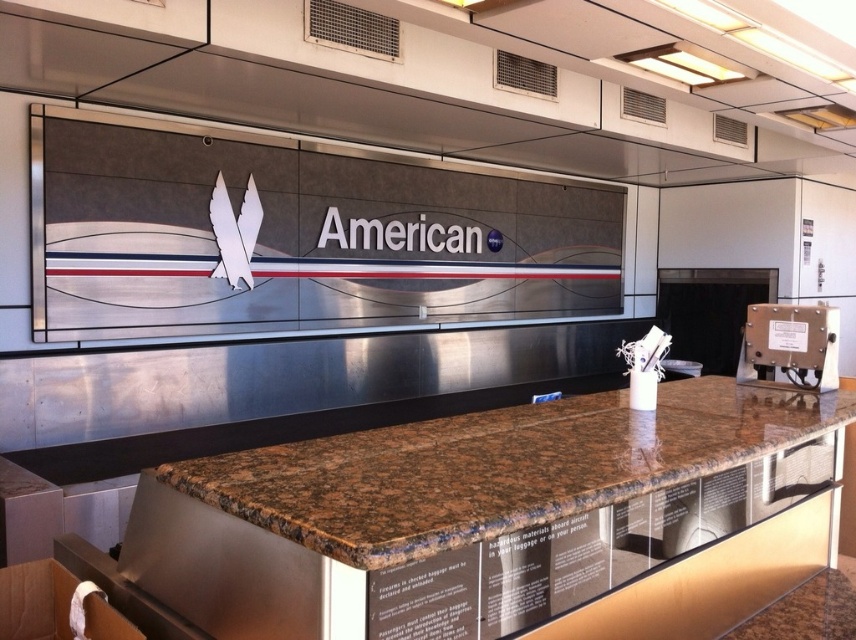
How much distance is there between metallic gray panel at right and white matte wings at center?

metallic gray panel at right is 10.04 feet from white matte wings at center.

Who is positioned more to the left, metallic gray panel at right or white matte wings at center?

Positioned to the left is white matte wings at center.

Who is more forward, [785,349] or [220,193]?

Positioned in front is point [785,349].

Where is `metallic gray panel at right`? Image resolution: width=856 pixels, height=640 pixels. metallic gray panel at right is located at coordinates (789, 346).

Does metallic silver sign at upper center have a greater height compared to brown granite counter at center?

Correct, metallic silver sign at upper center is much taller as brown granite counter at center.

This screenshot has width=856, height=640. What are the coordinates of `metallic silver sign at upper center` in the screenshot? It's located at coord(296,234).

Locate an element on the screen. The image size is (856, 640). metallic silver sign at upper center is located at coordinates (296, 234).

Locate an element on the screen. The height and width of the screenshot is (640, 856). metallic silver sign at upper center is located at coordinates (296, 234).

Who is lower down, brown granite counter at center or metallic gray panel at right?

brown granite counter at center

Who is more forward, (x=438, y=474) or (x=771, y=312)?

Positioned in front is point (x=438, y=474).

Find the location of a particular element. brown granite counter at center is located at coordinates (428, 497).